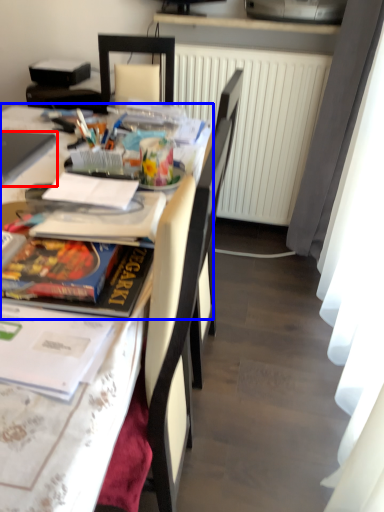
Question: Which object is further to the camera taking this photo, laptop (highlighted by a red box) or table (highlighted by a blue box)?

Choices:
 (A) laptop
 (B) table

Answer: (A)